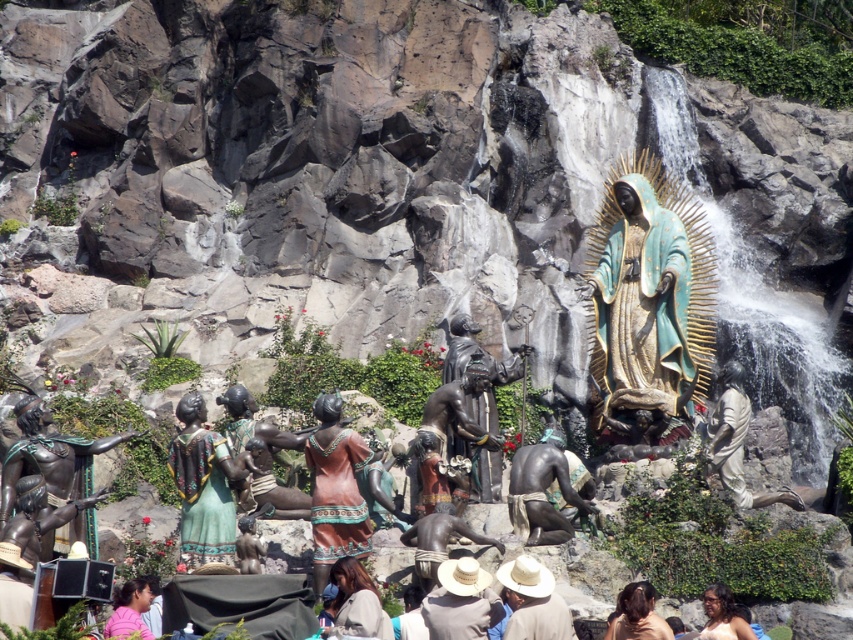
Question: Where is bronze statue at lower center located in relation to matte brown jacket at lower center in the image?

Choices:
 (A) above
 (B) below

Answer: (A)

Question: Which point appears farthest from the camera in this image?

Choices:
 (A) (621, 230)
 (B) (631, 588)
 (C) (556, 616)
 (D) (374, 636)

Answer: (A)

Question: Which point is closer to the camera?

Choices:
 (A) brown hair at lower center
 (B) bronze statue at center

Answer: (A)

Question: Among these points, which one is farthest from the camera?

Choices:
 (A) (526, 568)
 (B) (633, 630)
 (C) (601, 304)

Answer: (C)

Question: Can you confirm if bronze statue at center is thinner than pink fabric at lower left?

Choices:
 (A) yes
 (B) no

Answer: (B)

Question: Is gold-bronze statue at center-right positioned at the back of bronze statue at center?

Choices:
 (A) no
 (B) yes

Answer: (B)